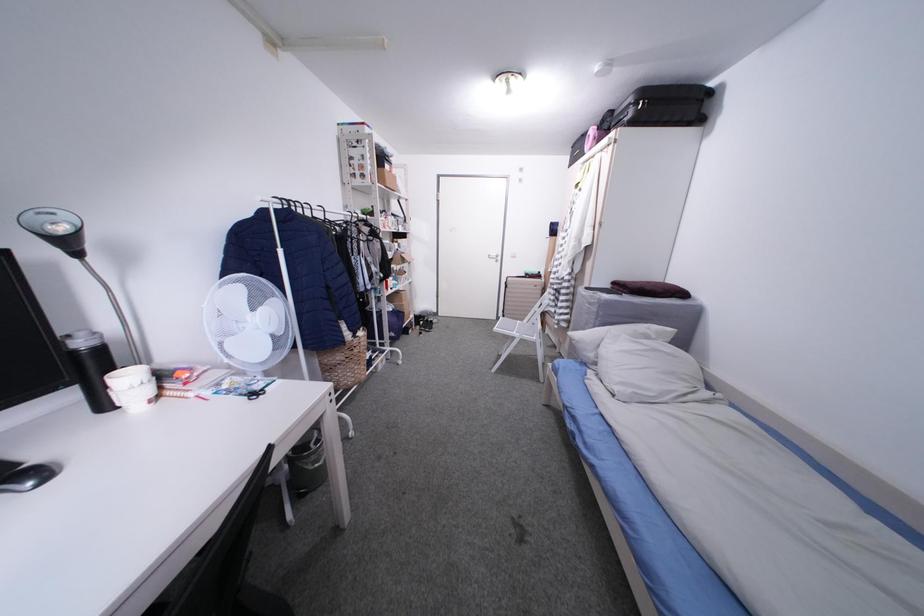
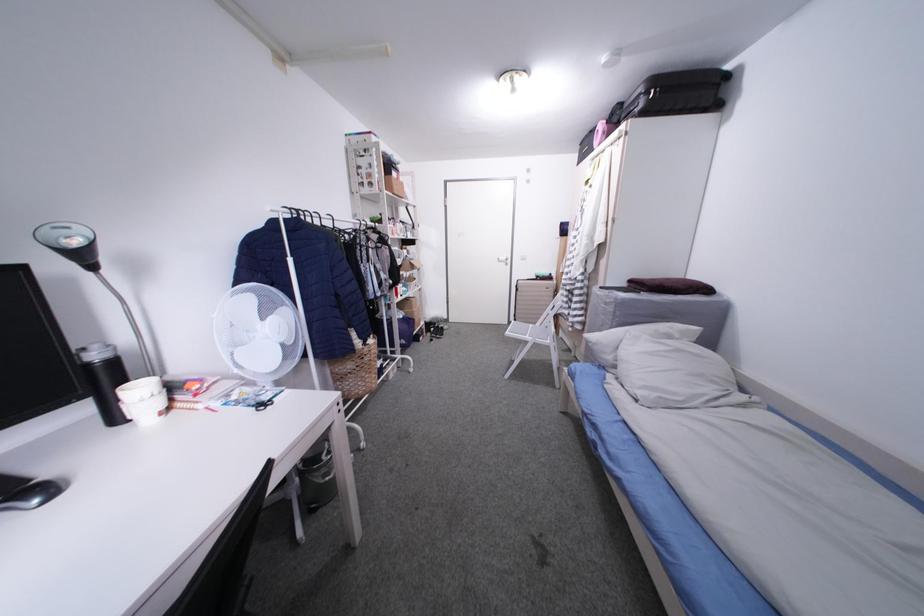
Question: The first image is from the beginning of the video and the second image is from the end. How did the camera likely rotate when shooting the video?

Choices:
 (A) Left
 (B) Right
 (C) Up
 (D) Down

Answer: (A)